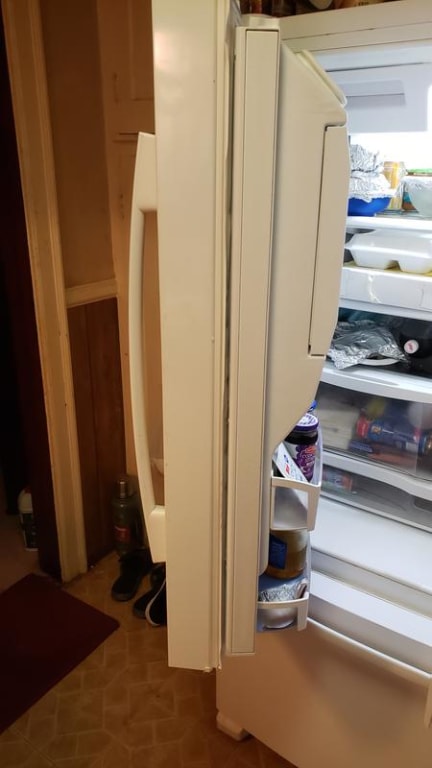
This screenshot has width=432, height=768. I want to click on grape jelly in refrigerator door, so click(x=303, y=442).